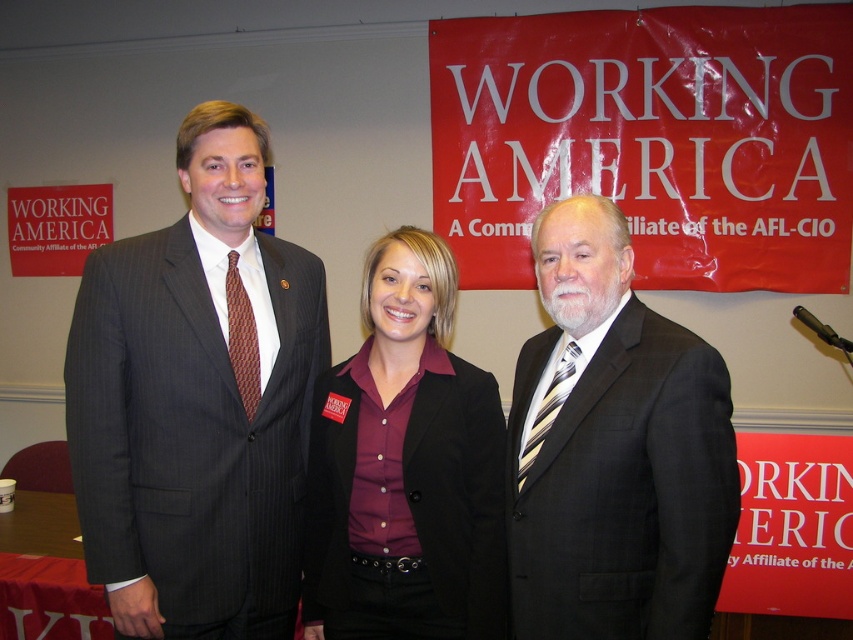
Is gray pinstripe suit at center thinner than striped silk tie at right?

No, gray pinstripe suit at center is not thinner than striped silk tie at right.

Is the position of gray pinstripe suit at center less distant than that of striped silk tie at right?

No.

Does point (300, 476) lie behind point (543, 436)?

That is True.

Identify the location of gray pinstripe suit at center. This screenshot has width=853, height=640. (195, 404).

Can you confirm if matte black blazer at center is smaller than matte black suit at left?

Indeed, matte black blazer at center has a smaller size compared to matte black suit at left.

In the scene shown: Is matte black blazer at center above matte black suit at left?

No.

Find the location of a particular element. matte black blazer at center is located at coordinates (405, 467).

Which is more to the right, black textured suit at center or matte black suit at left?

black textured suit at center

Is black textured suit at center positioned behind matte black suit at left?

No.

Identify the location of black textured suit at center. The height and width of the screenshot is (640, 853). (614, 451).